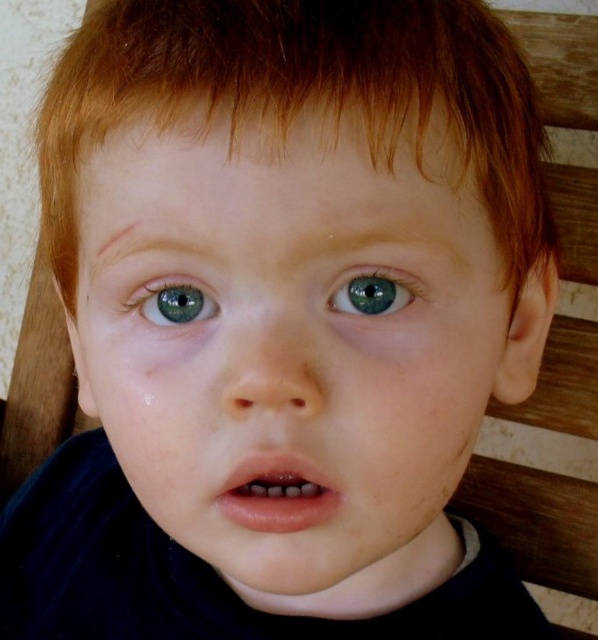
You are a photographer setting up for a portrait session. The subject is a child with a smooth skin face at center and reddish brown hair at upper center. You need to position a small prop between them. What is the minimum distance you should keep between the prop and the child to ensure it fits comfortably?

The smooth skin face at center and reddish brown hair at upper center are 4.88 centimeters apart, so the prop should be placed at least 4.88 centimeters away from both to fit comfortably between them.

You are a doctor examining a child with a swollen area under one eye. The point at coordinates (175, 301) marks the blue glossy eye at upper left. Can you determine if the swollen area is closer to the child or the blue glossy eye at upper left?

The point at coordinates (175, 301) marks the blue glossy eye at upper left, so the swollen area under one eye is closer to the child than the blue glossy eye at upper left.

Based on the scene description, where is the smooth skin face at center in relation to the blue glossy eye at center?

The smooth skin face at center is to the left of the blue glossy eye at center.